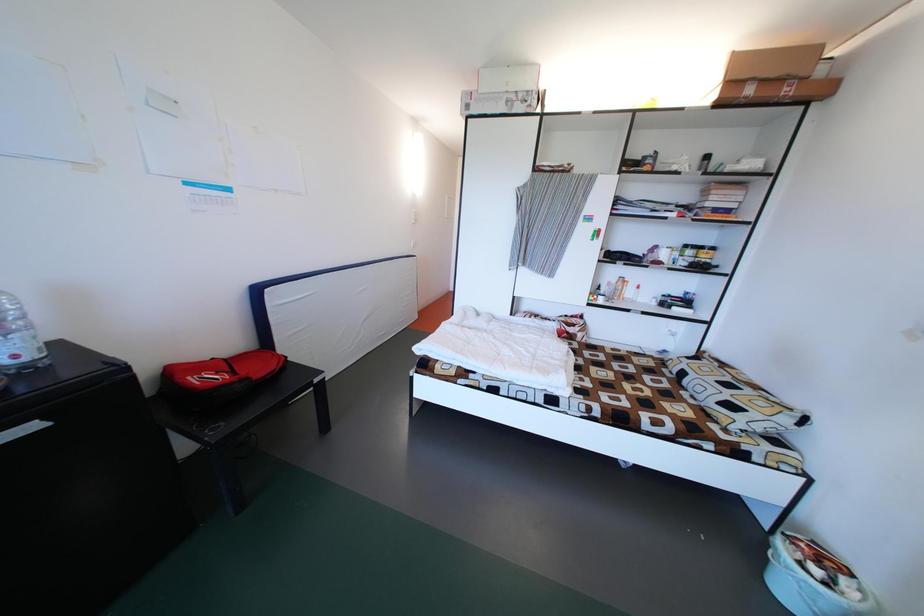
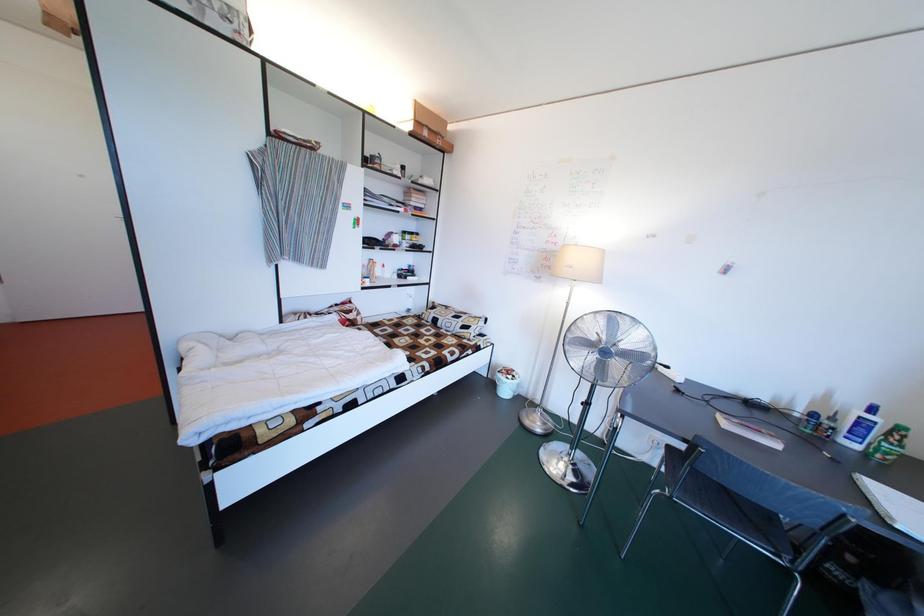
Question: The camera is either moving clockwise (left) or counter-clockwise (right) around the object. The first image is from the beginning of the video and the second image is from the end. Is the camera moving left or right when shooting the video?

Choices:
 (A) Left
 (B) Right

Answer: (A)